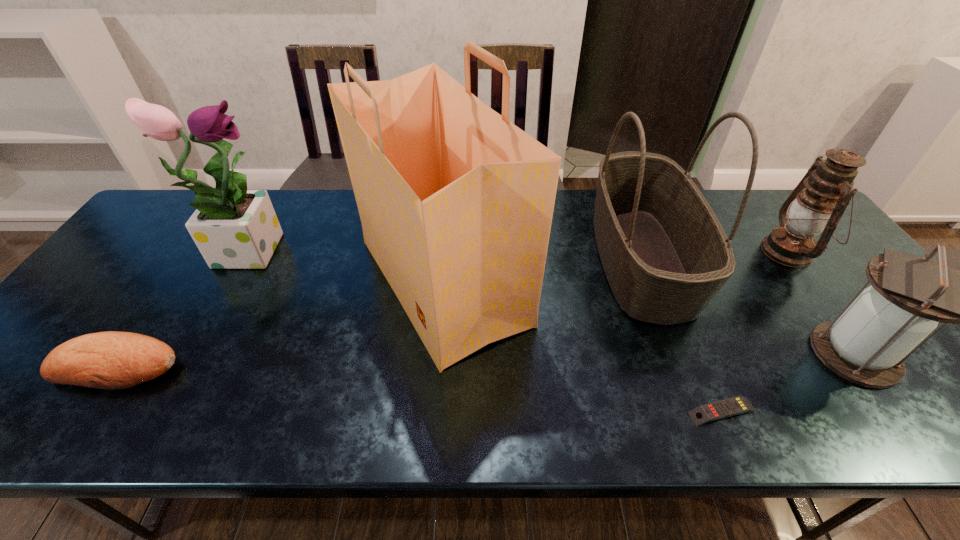
The image size is (960, 540). In order to click on object present at the near edge in this screenshot , I will do `click(729, 407)`.

This screenshot has height=540, width=960. I want to click on object that is at the left edge, so click(113, 360).

The image size is (960, 540). Identify the location of lantern present at the right edge. (818, 202).

Identify the location of lantern located at the right edge. (867, 344).

Where is `object present at the far right corner`? This screenshot has width=960, height=540. object present at the far right corner is located at coordinates (818, 202).

I want to click on free space at the far edge, so click(x=318, y=220).

Locate an element on the screen. This screenshot has width=960, height=540. blank space at the near right corner of the desktop is located at coordinates coord(917,421).

You are a GUI agent. You are given a task and a screenshot of the screen. Output one action in this format:
    pyautogui.click(x=<x>, y=<y>)
    Task: Click on the vacant region between the lantern and the lantern
    The image size is (960, 540).
    Given the screenshot: What is the action you would take?
    pyautogui.click(x=822, y=303)

At what (x,y) coordinates should I click in order to perform the action: click on vacant region between the flower arrangement and the bread. Please return your answer as a coordinate pair (x, y). The width and height of the screenshot is (960, 540). Looking at the image, I should click on [x=182, y=306].

Find the location of a particular element. vacant area that lies between the sixth tallest object and the basket is located at coordinates (379, 312).